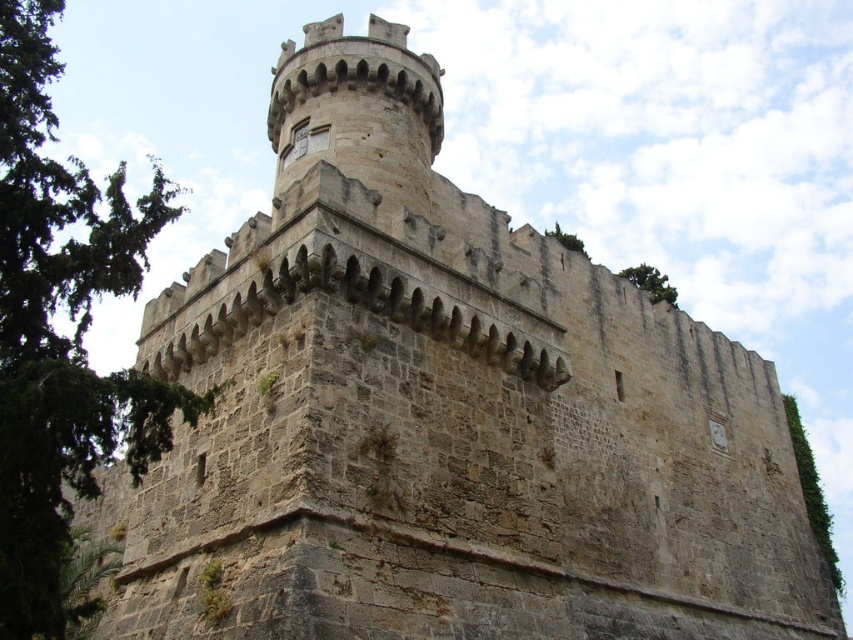
You are standing in front of the historic stone structure and want to determine which of the two points, point (77, 464) or point (662, 278), is nearer to you. Based on the structure, which point is closer?

→ Point (77, 464) is closer to the viewer than point (662, 278).

You are standing in front of the historic stone structure and want to determine which of the two points, point (788, 417) or point (579, 246), is closer to you. Based on the structure, which point is nearer?

Point (579, 246) is closer to you because it is less further to the camera than point (788, 417).

You are standing at a certain point and want to reach the entrance of the historic stone structure. The entrance is located at point (x=25, y=332). If you can walk 3 meters per minute, how many minutes will it take you to reach the entrance?

The distance between you and the entrance at point (x=25, y=332) is 31.24 meters. At a walking speed of 3 meters per minute, it would take approximately 10.41 minutes to reach the entrance.